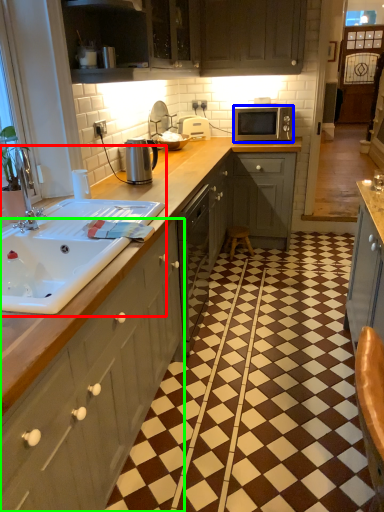
Question: Estimate the real-world distances between objects in this image. Which object is closer to sink (highlighted by a red box), microwave oven (highlighted by a blue box) or cabinetry (highlighted by a green box)?

Choices:
 (A) microwave oven
 (B) cabinetry

Answer: (B)